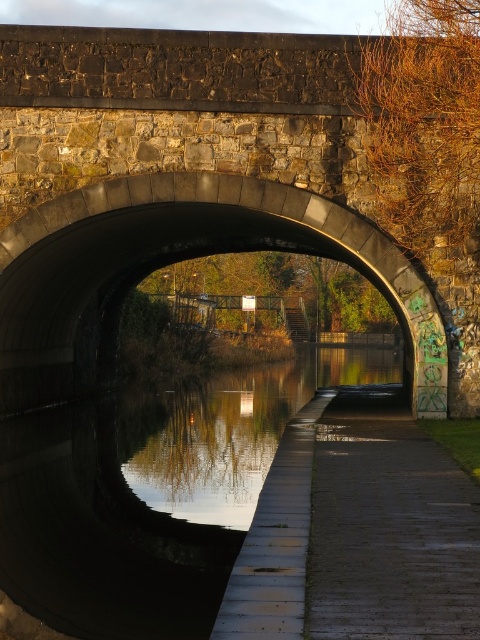
You are standing on the dark gray concrete path at center and want to see your reflection. Which direction should you look to see the dark reflective water at center?

The dark reflective water at center is to the left of the dark gray concrete path at center, so you should look to your left to see your reflection.

You are standing at the point marked by the coordinates point (183, 257). Looking towards the canal, which direction should you walk to reach the paved pathway on the right side of the canal?

The paved pathway on the right side of the canal is located to the right of the canal, so you should walk towards the right side of the canal from your current position at point (183, 257) to reach it.

You are standing at the entrance of the canal under the stone archway. You want to place a small floating decoration exactly at the center of the dark reflective water at center. According to the coordinates provided, where should you aim to place it?

The dark reflective water at center is located at point coordinates [149,493], so you should aim to place the decoration at those coordinates to reach the center.